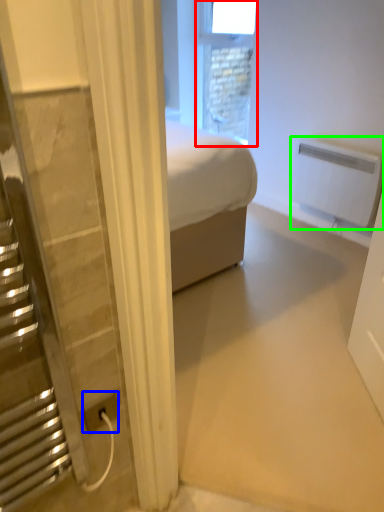
Question: Which object is the closest to the window (highlighted by a red box)? Choose among these: power plugs and sockets (highlighted by a blue box) or radiator (highlighted by a green box).

Choices:
 (A) power plugs and sockets
 (B) radiator

Answer: (B)